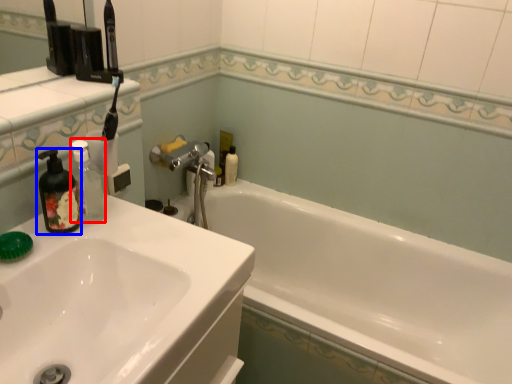
Question: Which object appears farthest to the camera in this image, bottle (highlighted by a red box) or soap dispenser (highlighted by a blue box)?

Choices:
 (A) bottle
 (B) soap dispenser

Answer: (A)